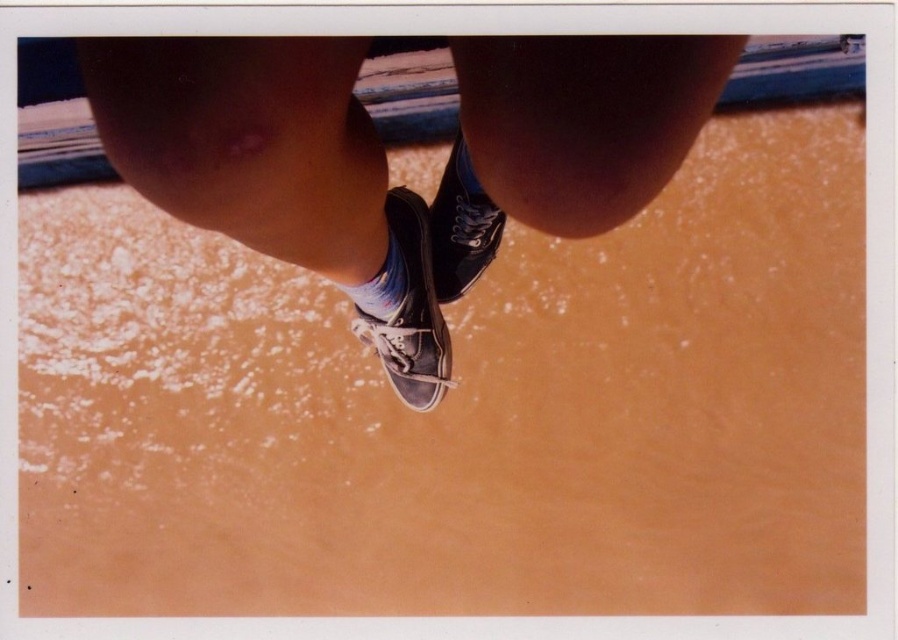
Who is positioned more to the left, matte black sneaker at center or multicolored fabric sock at center?

multicolored fabric sock at center

Which is behind, point (459, 180) or point (368, 304)?

Point (459, 180)

Who is more forward, (477,195) or (390,256)?

Point (390,256) is more forward.

Locate an element on the screen. This screenshot has height=640, width=898. matte black sneaker at center is located at coordinates (461, 227).

Between point (403, 244) and point (376, 317), which one is positioned in front?

Positioned in front is point (403, 244).

Can you confirm if black canvas shoe at center is positioned to the left of multicolored fabric sock at center?

No, black canvas shoe at center is not to the left of multicolored fabric sock at center.

Is point (403, 193) positioned before point (375, 310)?

That is False.

The width and height of the screenshot is (898, 640). I want to click on black canvas shoe at center, so click(x=410, y=308).

Who is more forward, (x=345, y=92) or (x=392, y=300)?

Point (x=345, y=92)

How much distance is there between canvas sneakers at center and multicolored fabric sock at center?

They are 7.92 inches apart.

Is point (705, 56) closer to camera compared to point (339, 282)?

That is True.

Where is `canvas sneakers at center`? This screenshot has width=898, height=640. canvas sneakers at center is located at coordinates (385, 156).